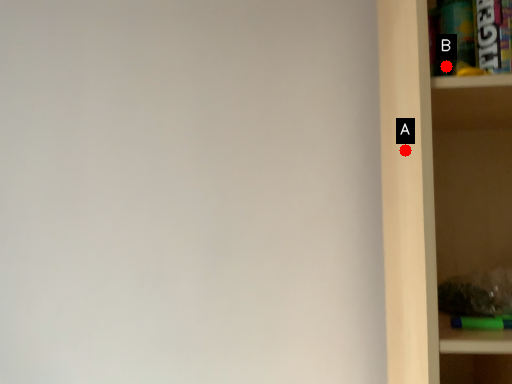
Question: Two points are circled on the image, labeled by A and B beside each circle. Which point is closer to the camera?

Choices:
 (A) A is closer
 (B) B is closer

Answer: (B)